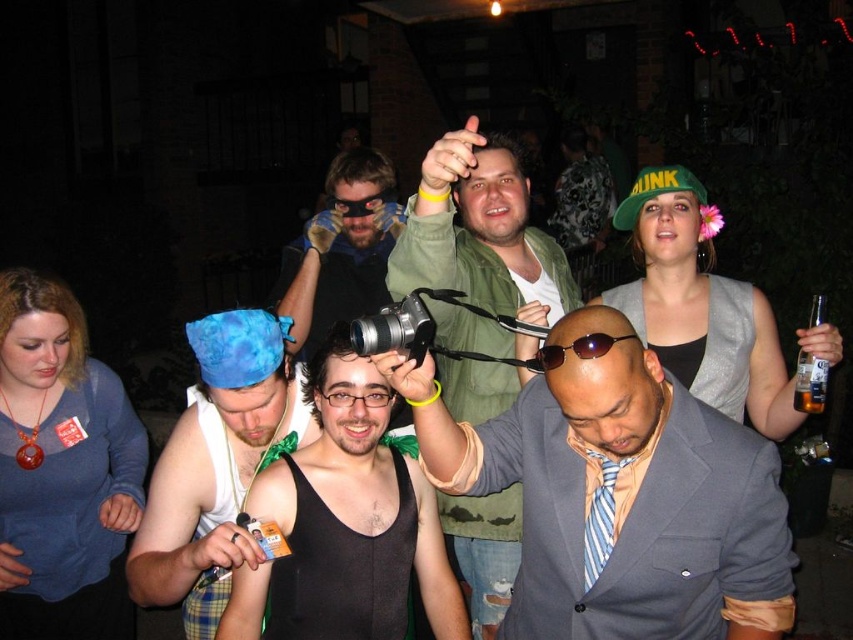
Is black matte tank top at center above clear glass bottle at right?

No.

Describe the element at coordinates (341, 570) in the screenshot. This screenshot has height=640, width=853. I see `black matte tank top at center` at that location.

The width and height of the screenshot is (853, 640). In order to click on black matte tank top at center in this screenshot , I will do `click(341, 570)`.

Is blue fabric hat at left to the left of black rubber goggles at center from the viewer's perspective?

Yes, blue fabric hat at left is to the left of black rubber goggles at center.

Who is positioned more to the left, blue fabric hat at left or black rubber goggles at center?

Positioned to the left is blue fabric hat at left.

You are a GUI agent. You are given a task and a screenshot of the screen. Output one action in this format:
    pyautogui.click(x=<x>, y=<y>)
    Task: Click on the blue fabric hat at left
    The height and width of the screenshot is (640, 853).
    Given the screenshot: What is the action you would take?
    coord(218,464)

Between point (618, 353) and point (447, 371), which one is positioned in front?

Point (618, 353)

Who is taller, gray suit at center or green matte jacket at center?

Standing taller between the two is green matte jacket at center.

Locate an element on the screen. The height and width of the screenshot is (640, 853). gray suit at center is located at coordinates (621, 500).

The width and height of the screenshot is (853, 640). I want to click on gray suit at center, so click(621, 500).